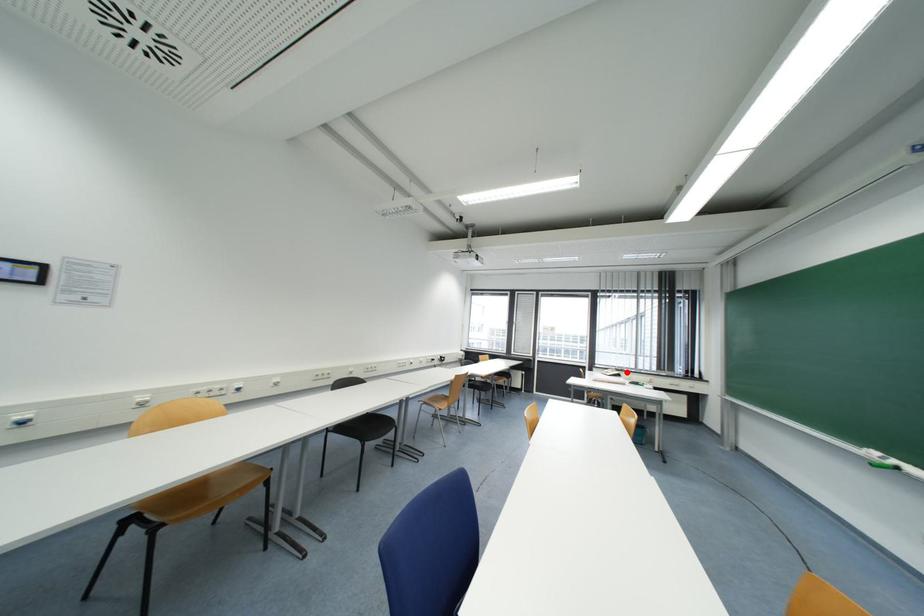
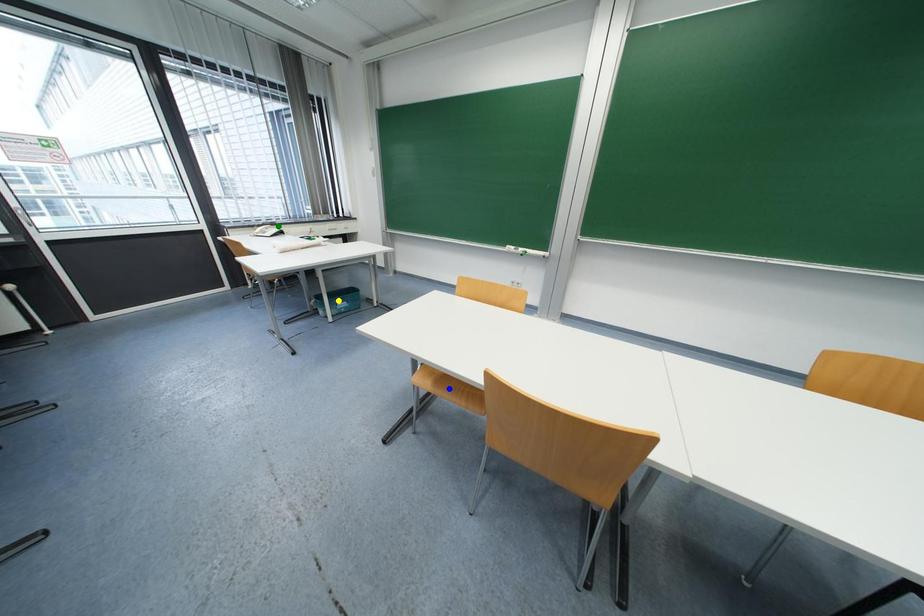
Question: I am providing you with two images of the same scene from different viewpoints. A red point is marked on the first image. You are given multiple points on the second image. Can you choose the point in image 2 that corresponds to the point in image 1?

Choices:
 (A) yellow point
 (B) green point
 (C) blue point

Answer: (B)